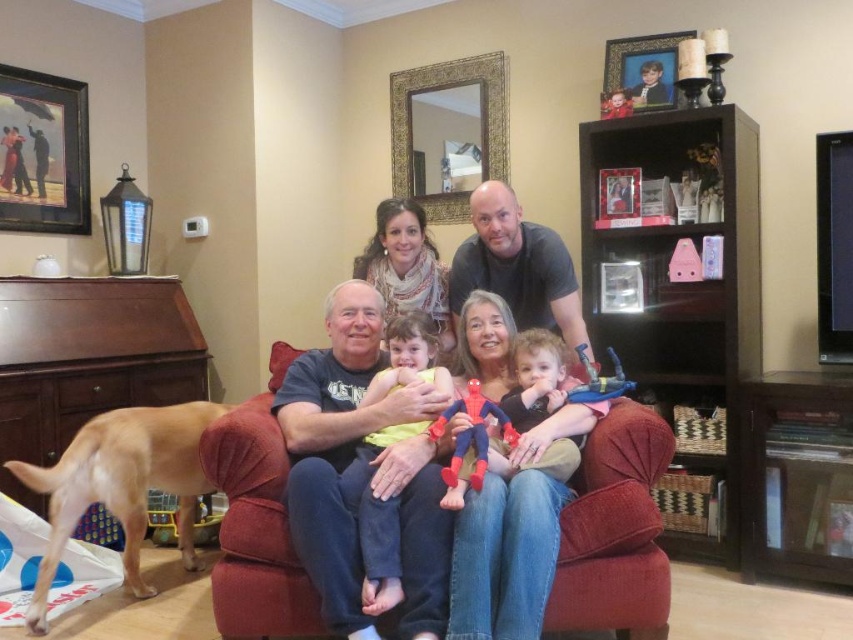
You are taking a photo of the family gathering in the living room. You want to focus on the point closer to the camera between the two points labeled as point (187,456) and point (675,35). Which point should you choose?

You should focus on point (187,456) because it is closer to the camera than point (675,35).